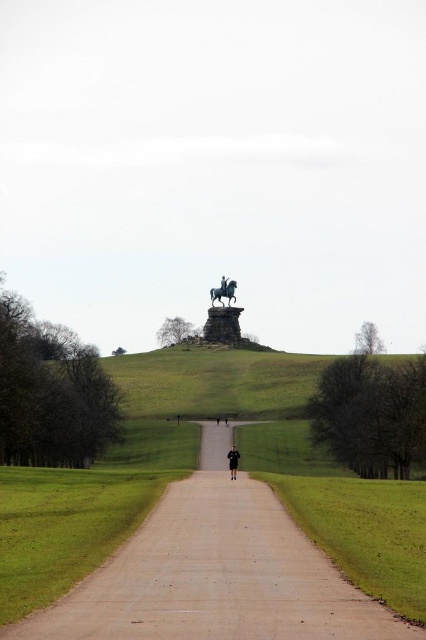
Can you confirm if green grass at center is taller than black polished statue at upper center?

Yes, green grass at center is taller than black polished statue at upper center.

In the scene shown: Can you confirm if green grass at center is positioned below black polished statue at upper center?

Indeed, green grass at center is positioned under black polished statue at upper center.

Is point (279, 461) in front of point (224, 285)?

Yes, point (279, 461) is closer to viewer.

Locate an element on the screen. The height and width of the screenshot is (640, 426). green grass at center is located at coordinates (345, 513).

The height and width of the screenshot is (640, 426). What are the coordinates of `green grass at center` in the screenshot? It's located at (345, 513).

Is green grass at center to the left of black leather jacket at center from the viewer's perspective?

In fact, green grass at center is to the right of black leather jacket at center.

This screenshot has width=426, height=640. What do you see at coordinates (345, 513) in the screenshot?
I see `green grass at center` at bounding box center [345, 513].

The height and width of the screenshot is (640, 426). Find the location of `green grass at center`. green grass at center is located at coordinates (345, 513).

Does smooth concrete path at center have a larger size compared to black fabric person at center?

Yes.

Between point (293, 561) and point (226, 419), which one is positioned in front?

Point (293, 561)

What are the coordinates of `smooth concrete path at center` in the screenshot? It's located at (215, 572).